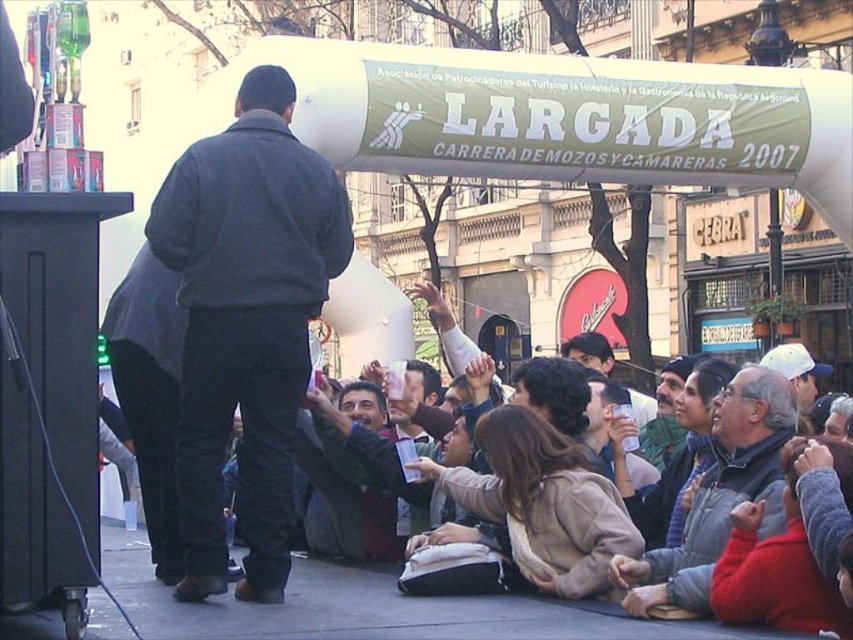
You are a photographer at the event and want to capture a photo that includes both the dark gray fleece jacket at center and the concrete pavement at lower center. Based on their positions, which object should you place on the left side of your photo frame?

The dark gray fleece jacket at center should be placed on the left side of your photo frame since it is positioned on the left side of the concrete pavement at lower center.

You are a photographer at the event and need to capture a photo of both the dark gray fleece jacket at center and the smooth brown jacket at center. Which jacket should you zoom in on to ensure both are fully visible in the frame?

The dark gray fleece jacket at center is wider than the smooth brown jacket at center, so you should zoom in on the dark gray fleece jacket at center to ensure both are fully visible in the frame.